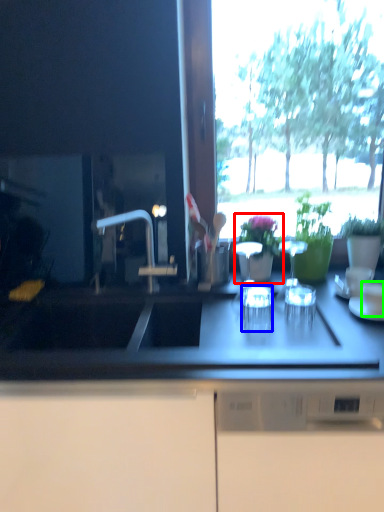
Question: Which object is the closest to the houseplant (highlighted by a red box)? Choose among these: tableware (highlighted by a blue box) or tableware (highlighted by a green box).

Choices:
 (A) tableware
 (B) tableware

Answer: (A)